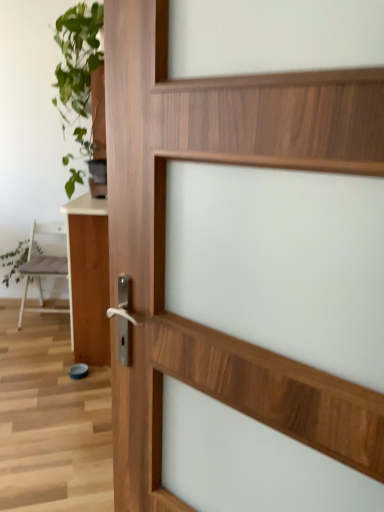
Question: From the image's perspective, does white glossy table at left appear lower than green leafy plant at upper left?

Choices:
 (A) no
 (B) yes

Answer: (B)

Question: Can you confirm if white glossy table at left is bigger than green leafy plant at upper left?

Choices:
 (A) no
 (B) yes

Answer: (A)

Question: Is white glossy table at left to the right of green leafy plant at upper left from the viewer's perspective?

Choices:
 (A) yes
 (B) no

Answer: (A)

Question: Is white glossy table at left at the left side of green leafy plant at upper left?

Choices:
 (A) yes
 (B) no

Answer: (B)

Question: Is white glossy table at left not within green leafy plant at upper left?

Choices:
 (A) yes
 (B) no

Answer: (A)

Question: Looking at their shapes, would you say white matte chair at left is wider or thinner than white glossy table at left?

Choices:
 (A) thin
 (B) wide

Answer: (B)

Question: From a real-world perspective, is white matte chair at left positioned above or below white glossy table at left?

Choices:
 (A) below
 (B) above

Answer: (A)

Question: Does point (23, 287) appear closer or farther from the camera than point (96, 294)?

Choices:
 (A) farther
 (B) closer

Answer: (A)

Question: Looking at the image, does white matte chair at left seem bigger or smaller compared to white glossy table at left?

Choices:
 (A) big
 (B) small

Answer: (B)

Question: Is green leafy plant at left situated inside white matte chair at left or outside?

Choices:
 (A) inside
 (B) outside

Answer: (B)

Question: Is green leafy plant at left taller or shorter than white matte chair at left?

Choices:
 (A) short
 (B) tall

Answer: (A)

Question: Is point (13, 254) closer or farther from the camera than point (64, 274)?

Choices:
 (A) farther
 (B) closer

Answer: (B)

Question: Relative to white matte chair at left, is green leafy plant at left in front or behind?

Choices:
 (A) behind
 (B) front

Answer: (A)

Question: From the image's perspective, is white glossy table at left above or below green leafy plant at left?

Choices:
 (A) above
 (B) below

Answer: (B)

Question: From a real-world perspective, is white glossy table at left physically located above or below green leafy plant at left?

Choices:
 (A) below
 (B) above

Answer: (B)